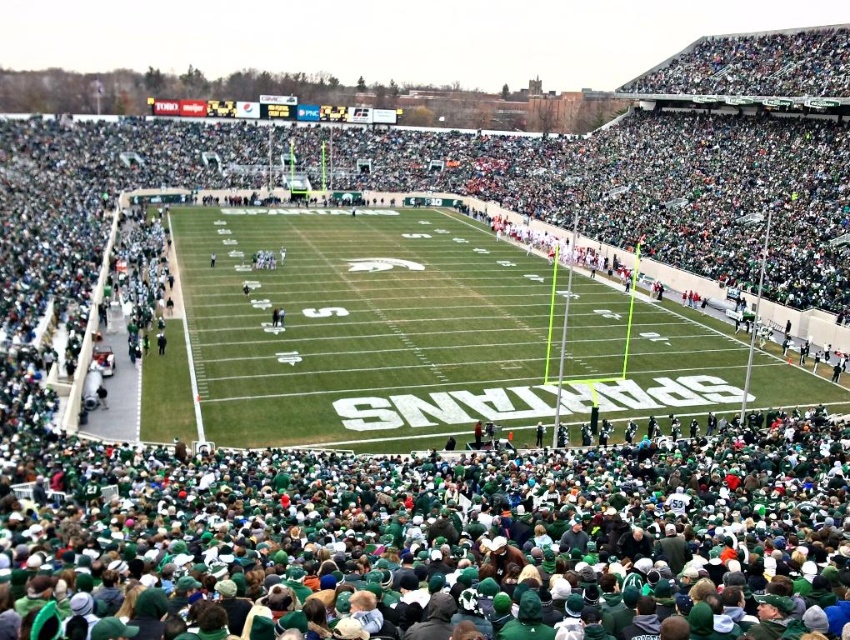
Question: Can you confirm if green fabric crowd at lower center is positioned to the left of green grass football field at center?

Choices:
 (A) no
 (B) yes

Answer: (A)

Question: Can you confirm if green fabric crowd at lower center is smaller than green grass football field at center?

Choices:
 (A) yes
 (B) no

Answer: (A)

Question: Is green fabric crowd at lower center below green grass football field at center?

Choices:
 (A) no
 (B) yes

Answer: (B)

Question: Among these points, which one is nearest to the camera?

Choices:
 (A) (315, 456)
 (B) (785, 369)

Answer: (A)